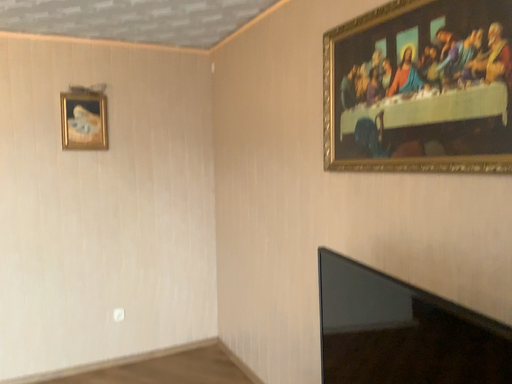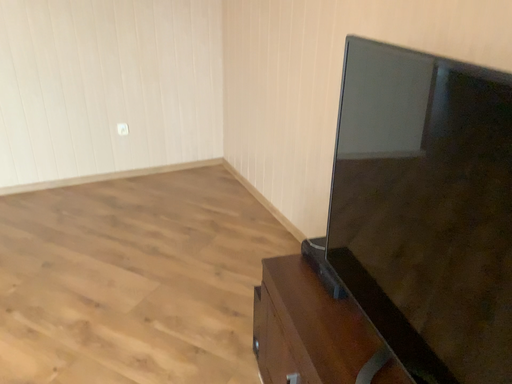
Question: How did the camera likely rotate when shooting the video?

Choices:
 (A) rotated downward
 (B) rotated upward

Answer: (A)